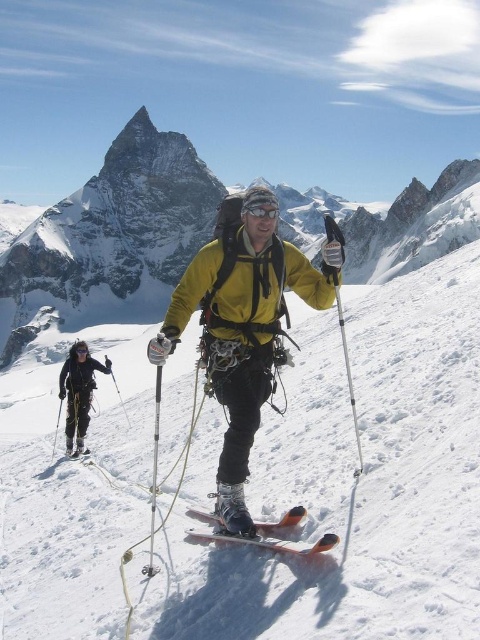
Who is positioned more to the left, white matte snow at center or silver metallic ski pole at center?

From the viewer's perspective, white matte snow at center appears more on the left side.

Between white matte snow at center and silver metallic ski pole at center, which one has less height?

With less height is white matte snow at center.

The width and height of the screenshot is (480, 640). What do you see at coordinates (362, 490) in the screenshot?
I see `white matte snow at center` at bounding box center [362, 490].

Locate an element on the screen. This screenshot has width=480, height=640. white matte snow at center is located at coordinates (362, 490).

Between white snow mountain at upper left and black matte goggles at upper center, which one has more height?

With more height is white snow mountain at upper left.

Measure the distance from white snow mountain at upper left to black matte goggles at upper center.

121.07 meters

Who is more distant from viewer, (303, 198) or (74, 349)?

The point (303, 198) is more distant.

I want to click on white snow mountain at upper left, so click(108, 240).

Can you confirm if black matte ski pants at lower left is thinner than black matte goggles at upper center?

Incorrect, black matte ski pants at lower left's width is not less than black matte goggles at upper center's.

Is black matte ski pants at lower left above black matte goggles at upper center?

No, black matte ski pants at lower left is not above black matte goggles at upper center.

Between point (83, 397) and point (87, 353), which one is positioned behind?

The point (87, 353) is behind.

Where is `black matte ski pants at lower left`? Image resolution: width=480 pixels, height=640 pixels. black matte ski pants at lower left is located at coordinates (79, 394).